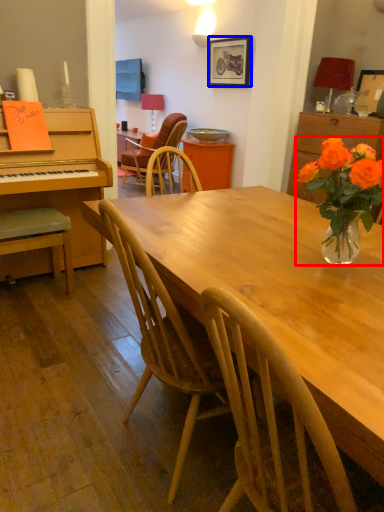
Question: Which object is closer to the camera taking this photo, houseplant (highlighted by a red box) or picture frame (highlighted by a blue box)?

Choices:
 (A) houseplant
 (B) picture frame

Answer: (A)